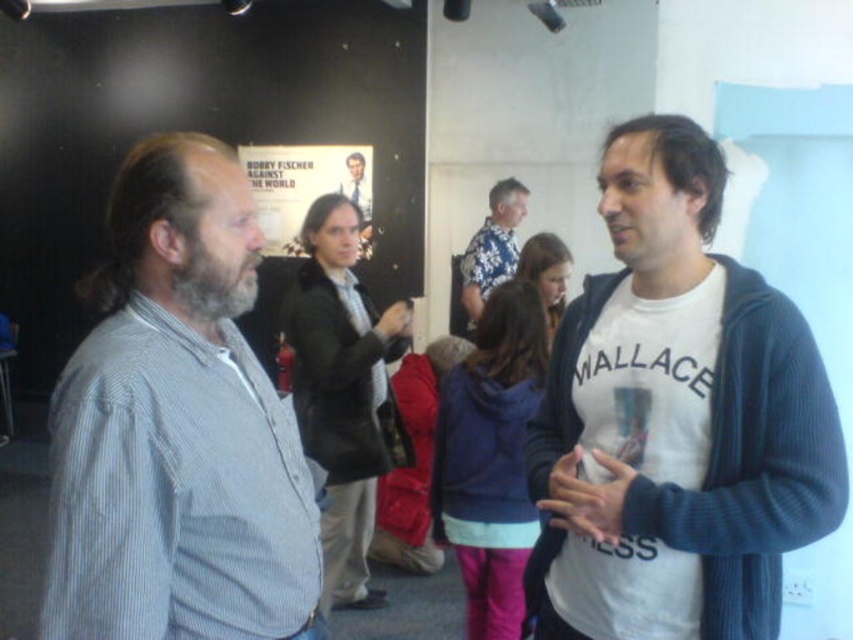
You are organizing a photo shoot and need to ensure proper lighting. The striped cotton shirt at left and smooth black suit at center are both in the frame. Based on their positions, which object should be prioritized for lighting adjustments to ensure visibility?

The striped cotton shirt at left should be prioritized for lighting adjustments because it is in front of the smooth black suit at center, making it more prominent in the frame.